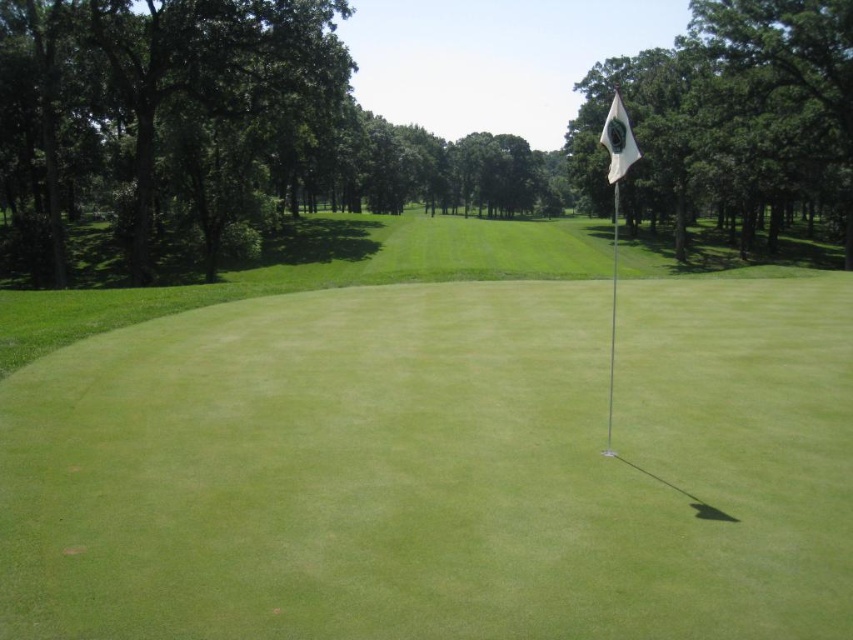
Measure the distance between point [743,212] and camera.

A distance of 60.27 meters exists between point [743,212] and camera.

Between point (781, 0) and point (631, 161), which one is positioned behind?

The point (781, 0) is behind.

Looking at this image, measure the distance between point (833, 138) and camera.

Point (833, 138) is 44.14 meters away from camera.

Image resolution: width=853 pixels, height=640 pixels. In order to click on green leafy tree at upper right in this screenshot , I will do `click(735, 109)`.

Is point (112, 42) positioned behind point (692, 154)?

No, (112, 42) is in front of (692, 154).

Is green leafy tree at left closer to the viewer compared to green leafy tree at upper right?

Yes, it is in front of green leafy tree at upper right.

This screenshot has height=640, width=853. I want to click on green leafy tree at left, so click(x=151, y=77).

Find the location of `green leafy tree at left`. green leafy tree at left is located at coordinates (151, 77).

Between green grass flag at center and green leafy tree at left, which one appears on the left side from the viewer's perspective?

From the viewer's perspective, green leafy tree at left appears more on the left side.

Does point (700, 481) lie behind point (27, 84)?

No, (700, 481) is closer to viewer.

Which is behind, point (315, 547) or point (201, 61)?

Positioned behind is point (201, 61).

The width and height of the screenshot is (853, 640). Identify the location of green grass flag at center. (432, 449).